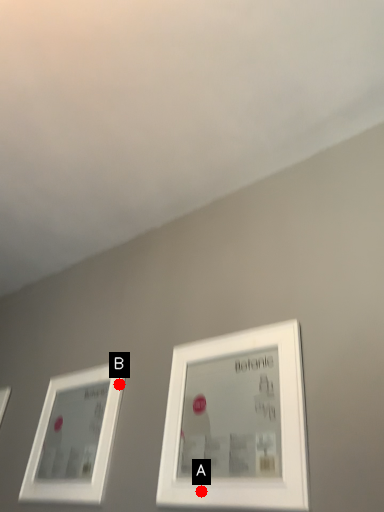
Question: Two points are circled on the image, labeled by A and B beside each circle. Which point appears farthest from the camera in this image?

Choices:
 (A) A is further
 (B) B is further

Answer: (B)